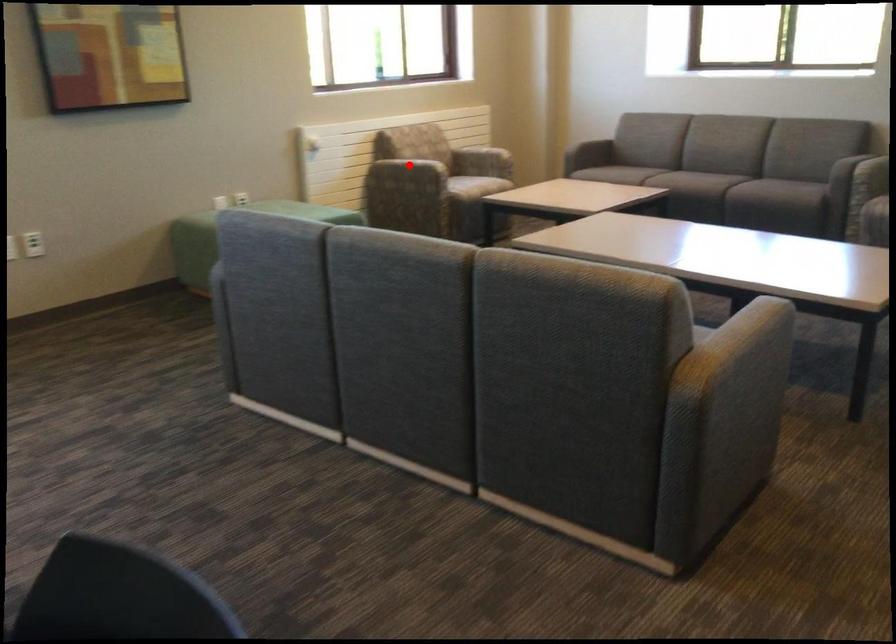
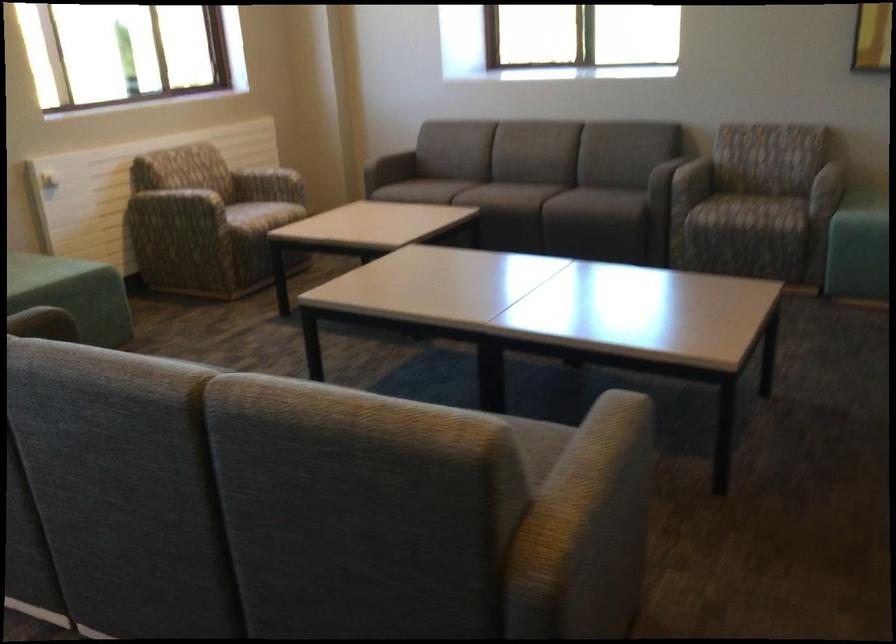
Where in the second image is the point corresponding to the highlighted location from the first image?

(179, 204)